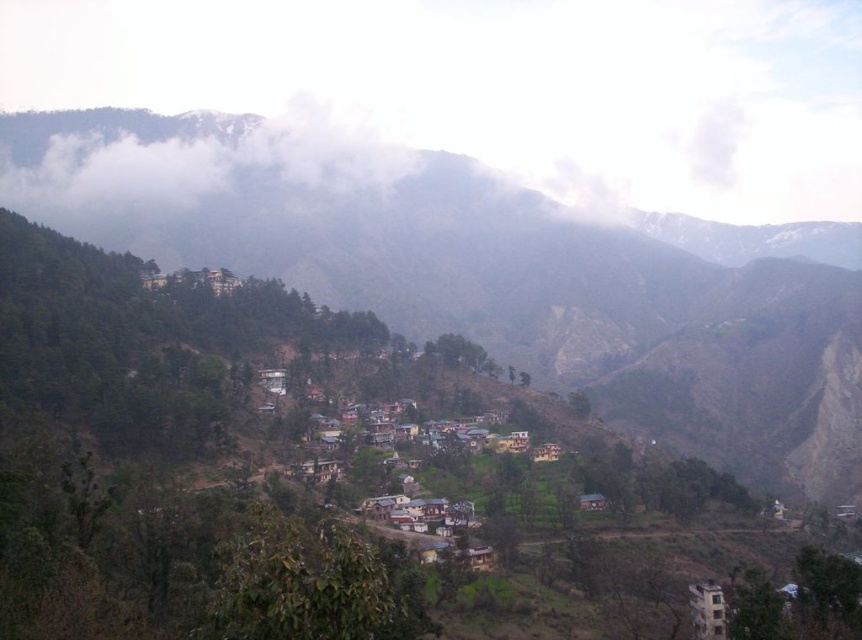
Question: Does green textured hillside at center have a greater width compared to white fluffy cloud at upper center?

Choices:
 (A) yes
 (B) no

Answer: (A)

Question: Is green textured hillside at center bigger than white fluffy cloud at upper center?

Choices:
 (A) no
 (B) yes

Answer: (B)

Question: Does green textured hillside at center appear on the right side of white fluffy cloud at upper center?

Choices:
 (A) yes
 (B) no

Answer: (A)

Question: Among these points, which one is farthest from the camera?

Choices:
 (A) (798, 305)
 (B) (289, 182)

Answer: (B)

Question: Which of the following is the farthest from the observer?

Choices:
 (A) (83, 188)
 (B) (553, 278)

Answer: (A)

Question: Which object is farther from the camera taking this photo?

Choices:
 (A) green textured hillside at center
 (B) white fluffy cloud at upper center

Answer: (B)